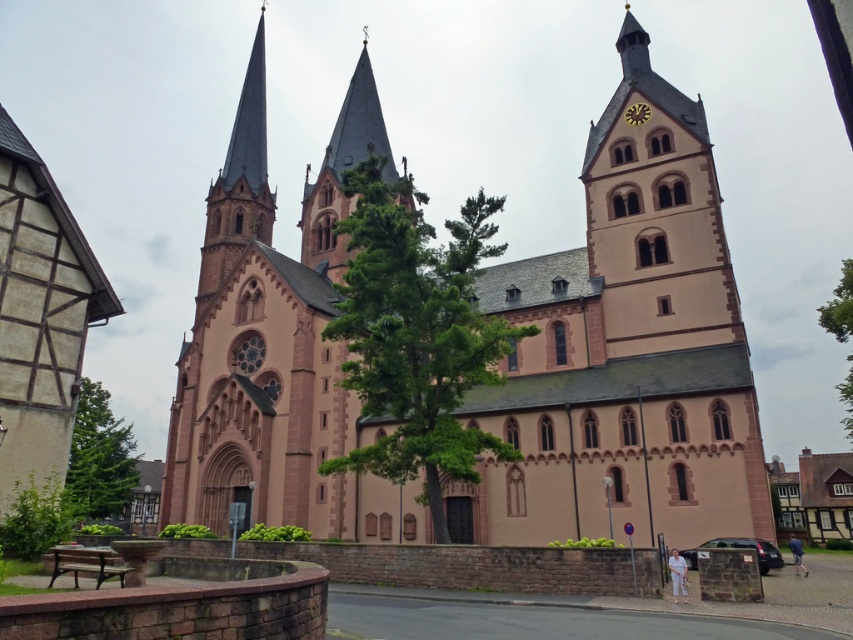
You are standing at a certain distance from the smooth pink stone tower at center. If you want to take a photo of it with your camera, which is set to a focal length of 50mm, will you need to move closer or farther away to ensure the tower fills the frame properly?

The smooth pink stone tower at center is 54.41 meters away from the camera. To fill the frame with the tower using a 50mm lens, you would typically need to be closer than 54.41 meters. Therefore, you should move closer to the tower.

You are standing in the churchyard and want to take a photo of the smooth pink stone tower at center and the green leafy tree at lower left. To ensure both are in the frame, should you position yourself to the left or right of the tree?

You should position yourself to the left of the green leafy tree at lower left so that the smooth pink stone tower at center, which is to the right of the tree, remains in view.